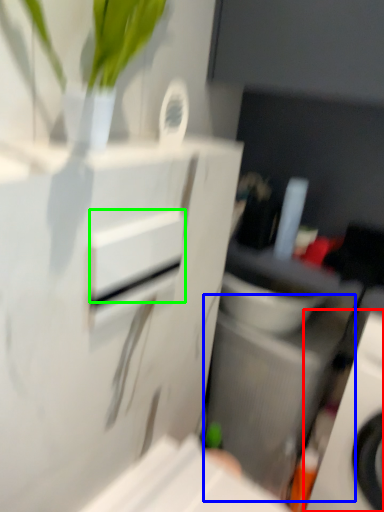
Question: Estimate the real-world distances between objects in this image. Which object is farther from home appliance (highlighted by a red box), appliance (highlighted by a blue box) or drawer (highlighted by a green box)?

Choices:
 (A) appliance
 (B) drawer

Answer: (B)